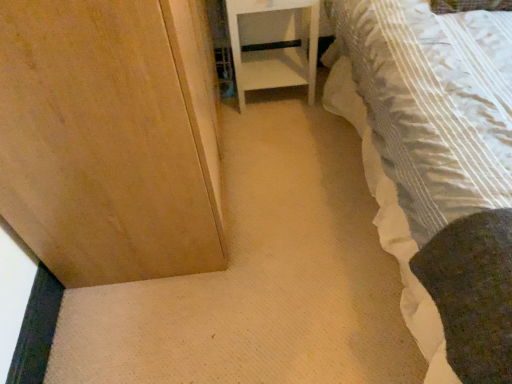
At what (x,y) coordinates should I click in order to perform the action: click on white glossy nightstand at center. Please return your answer as a coordinate pair (x, y). The image size is (512, 384). Looking at the image, I should click on (275, 50).

The image size is (512, 384). What do you see at coordinates (275, 50) in the screenshot? I see `white glossy nightstand at center` at bounding box center [275, 50].

At what (x,y) coordinates should I click in order to perform the action: click on white striped fabric bed at lower right. Please return your answer as a coordinate pair (x, y). Looking at the image, I should click on (444, 166).

Describe the element at coordinates (444, 166) in the screenshot. I see `white striped fabric bed at lower right` at that location.

At what (x,y) coordinates should I click in order to perform the action: click on white glossy nightstand at center. Please return your answer as a coordinate pair (x, y). This screenshot has width=512, height=384. Looking at the image, I should click on (275, 50).

Between white glossy nightstand at center and white striped fabric bed at lower right, which one appears on the left side from the viewer's perspective?

→ Positioned to the left is white glossy nightstand at center.

Which object is more forward, white glossy nightstand at center or white striped fabric bed at lower right?

white striped fabric bed at lower right is closer to the camera.

Is point (248, 1) positioned after point (425, 292)?

Yes, point (248, 1) is farther from viewer.

From the image's perspective, is white glossy nightstand at center positioned above or below white striped fabric bed at lower right?

Based on their image positions, white glossy nightstand at center is located above white striped fabric bed at lower right.

From a real-world perspective, which is physically above, white glossy nightstand at center or white striped fabric bed at lower right?

white striped fabric bed at lower right is physically above.

Which object is wider, white glossy nightstand at center or white striped fabric bed at lower right?

With larger width is white striped fabric bed at lower right.

Is white glossy nightstand at center shorter than white striped fabric bed at lower right?

Yes, white glossy nightstand at center is shorter than white striped fabric bed at lower right.

In the scene shown: Does white glossy nightstand at center have a smaller size compared to white striped fabric bed at lower right?

Yes, white glossy nightstand at center is smaller than white striped fabric bed at lower right.

Is white striped fabric bed at lower right located within white glossy nightstand at center?

No, white striped fabric bed at lower right is not inside white glossy nightstand at center.

Is there a large distance between white glossy nightstand at center and white striped fabric bed at lower right?

They are positioned close to each other.

Is white glossy nightstand at center looking in the opposite direction of white striped fabric bed at lower right?

No, white glossy nightstand at center is not facing away from white striped fabric bed at lower right.

How many degrees apart are the facing directions of white glossy nightstand at center and white striped fabric bed at lower right?

They differ by 0.116 degrees in their facing directions.

This screenshot has width=512, height=384. Identify the location of furniture behind the white striped fabric bed at lower right. (275, 50).

Is white striped fabric bed at lower right at the right side of white glossy nightstand at center?

Correct, you'll find white striped fabric bed at lower right to the right of white glossy nightstand at center.

Considering the relative positions of white striped fabric bed at lower right and white glossy nightstand at center in the image provided, is white striped fabric bed at lower right behind white glossy nightstand at center?

No, white striped fabric bed at lower right is closer to the camera.

Is point (486, 288) positioned behind point (248, 84)?

No, it is in front of (248, 84).

From the image's perspective, is white striped fabric bed at lower right beneath white glossy nightstand at center?

Indeed, from the image's perspective, white striped fabric bed at lower right is shown beneath white glossy nightstand at center.

From a real-world perspective, who is located lower, white striped fabric bed at lower right or white glossy nightstand at center?

In real-world perspective, white glossy nightstand at center is lower.

Does white striped fabric bed at lower right have a lesser width compared to white glossy nightstand at center?

No.

Does white striped fabric bed at lower right have a lesser height compared to white glossy nightstand at center?

No.

Is white striped fabric bed at lower right bigger or smaller than white glossy nightstand at center?

In the image, white striped fabric bed at lower right appears to be larger than white glossy nightstand at center.

Would you say white striped fabric bed at lower right is inside or outside white glossy nightstand at center?

white striped fabric bed at lower right cannot be found inside white glossy nightstand at center.

Are white striped fabric bed at lower right and white glossy nightstand at center making contact?

No.

Is white striped fabric bed at lower right oriented towards white glossy nightstand at center?

No, white striped fabric bed at lower right is not turned towards white glossy nightstand at center.

Image resolution: width=512 pixels, height=384 pixels. Identify the location of furniture to the left of white striped fabric bed at lower right. (275, 50).

Where is `furniture above the white striped fabric bed at lower right (from the image's perspective)`? The width and height of the screenshot is (512, 384). furniture above the white striped fabric bed at lower right (from the image's perspective) is located at coordinates (275, 50).

Identify the location of furniture to the left of white striped fabric bed at lower right. The width and height of the screenshot is (512, 384). (275, 50).